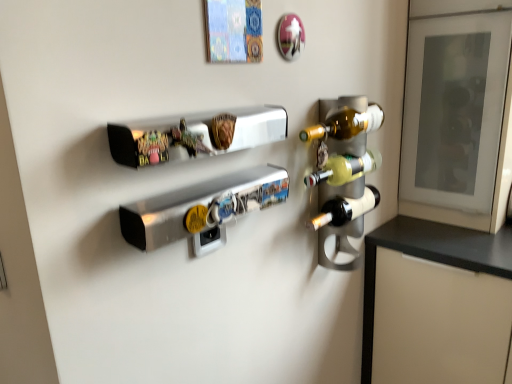
Question: Is transparent glass door at upper right facing towards translucent glass wine bottle at right, the second bottle ordered from the bottom?

Choices:
 (A) no
 (B) yes

Answer: (B)

Question: Considering the relative sizes of transparent glass door at upper right and translucent glass wine bottle at right, the second bottle ordered from the bottom, in the image provided, is transparent glass door at upper right smaller than translucent glass wine bottle at right, the second bottle ordered from the bottom,?

Choices:
 (A) no
 (B) yes

Answer: (A)

Question: Does transparent glass door at upper right have a greater height compared to translucent glass wine bottle at right, the second bottle ordered from the bottom?

Choices:
 (A) yes
 (B) no

Answer: (A)

Question: Does transparent glass door at upper right appear on the left side of translucent glass wine bottle at right, positioned as the 1th bottle in top-to-bottom order?

Choices:
 (A) no
 (B) yes

Answer: (A)

Question: Is transparent glass door at upper right to the right of translucent glass wine bottle at right, the second bottle ordered from the bottom, from the viewer's perspective?

Choices:
 (A) no
 (B) yes

Answer: (B)

Question: From a real-world perspective, relative to metallic silver shelf at upper center, is transparent glass door at upper right vertically above or below?

Choices:
 (A) above
 (B) below

Answer: (B)

Question: Based on their positions, is transparent glass door at upper right located to the left or right of metallic silver shelf at upper center?

Choices:
 (A) right
 (B) left

Answer: (A)

Question: In terms of height, does transparent glass door at upper right look taller or shorter compared to metallic silver shelf at upper center?

Choices:
 (A) tall
 (B) short

Answer: (A)

Question: In the image, is transparent glass door at upper right positioned in front of or behind metallic silver shelf at upper center?

Choices:
 (A) behind
 (B) front

Answer: (A)

Question: Does point (300, 135) appear closer or farther from the camera than point (503, 34)?

Choices:
 (A) closer
 (B) farther

Answer: (A)

Question: From a real-world perspective, relative to transparent glass door at upper right, is translucent glass wine bottle at right, positioned as the 1th bottle in top-to-bottom order, vertically above or below?

Choices:
 (A) above
 (B) below

Answer: (A)

Question: Based on their positions, is translucent glass wine bottle at right, the second bottle ordered from the bottom, located to the left or right of transparent glass door at upper right?

Choices:
 (A) right
 (B) left

Answer: (B)

Question: Is translucent glass wine bottle at right, positioned as the 1th bottle in top-to-bottom order, taller or shorter than transparent glass door at upper right?

Choices:
 (A) tall
 (B) short

Answer: (B)

Question: Is translucent glass wine bottle at right, positioned as the 1th bottle in top-to-bottom order, inside the boundaries of metallic silver shelf at upper center, or outside?

Choices:
 (A) inside
 (B) outside

Answer: (B)

Question: Looking at the image, does translucent glass wine bottle at right, positioned as the 1th bottle in top-to-bottom order, seem bigger or smaller compared to metallic silver shelf at upper center?

Choices:
 (A) big
 (B) small

Answer: (A)